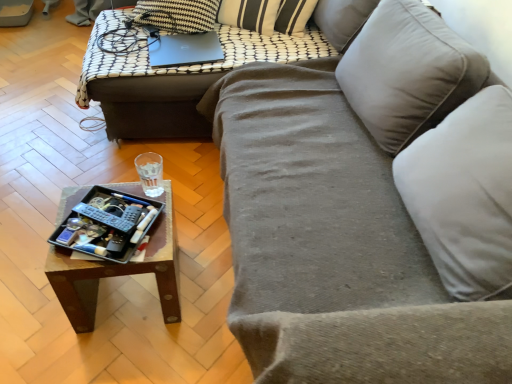
Question: Is wooden tray at center thinner than wooden tray at center?

Choices:
 (A) no
 (B) yes

Answer: (B)

Question: From a real-world perspective, is wooden tray at center located beneath wooden tray at center?

Choices:
 (A) yes
 (B) no

Answer: (A)

Question: Considering the relative sizes of wooden tray at center and wooden tray at center in the image provided, is wooden tray at center taller than wooden tray at center?

Choices:
 (A) yes
 (B) no

Answer: (B)

Question: Does wooden tray at center have a larger size compared to wooden tray at center?

Choices:
 (A) no
 (B) yes

Answer: (A)

Question: Is wooden tray at center in front of wooden tray at center?

Choices:
 (A) no
 (B) yes

Answer: (B)

Question: From a real-world perspective, is wooden tray at center positioned over wooden tray at center based on gravity?

Choices:
 (A) no
 (B) yes

Answer: (A)

Question: Can you confirm if wooden tray at center is smaller than velvet gray couch at center?

Choices:
 (A) yes
 (B) no

Answer: (A)

Question: Does wooden tray at center have a greater width compared to velvet gray couch at center?

Choices:
 (A) no
 (B) yes

Answer: (A)

Question: Is wooden tray at center aimed at velvet gray couch at center?

Choices:
 (A) yes
 (B) no

Answer: (B)

Question: Is wooden tray at center turned away from velvet gray couch at center?

Choices:
 (A) no
 (B) yes

Answer: (B)

Question: Is wooden tray at center taller than velvet gray couch at center?

Choices:
 (A) yes
 (B) no

Answer: (B)

Question: Does wooden tray at center have a larger size compared to velvet gray couch at center?

Choices:
 (A) yes
 (B) no

Answer: (B)

Question: Does wooden tray at center have a greater height compared to wooden tray at center?

Choices:
 (A) no
 (B) yes

Answer: (B)